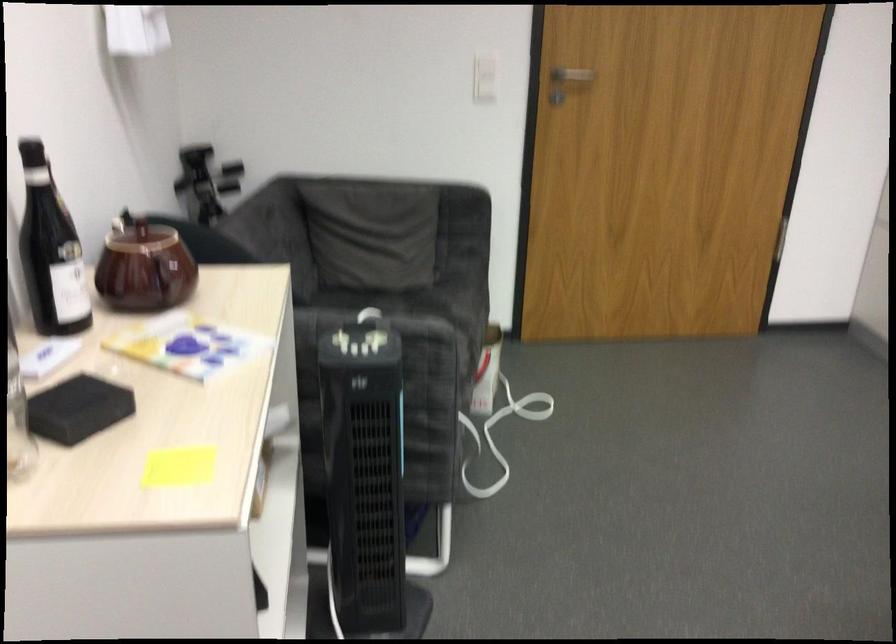
What do you see at coordinates (460, 335) in the screenshot?
I see `the chair sitting surface` at bounding box center [460, 335].